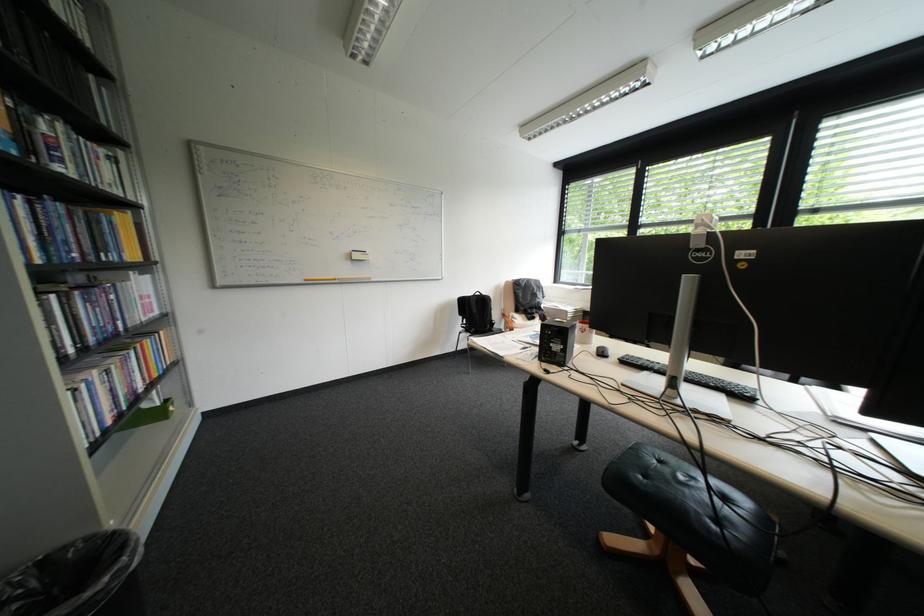
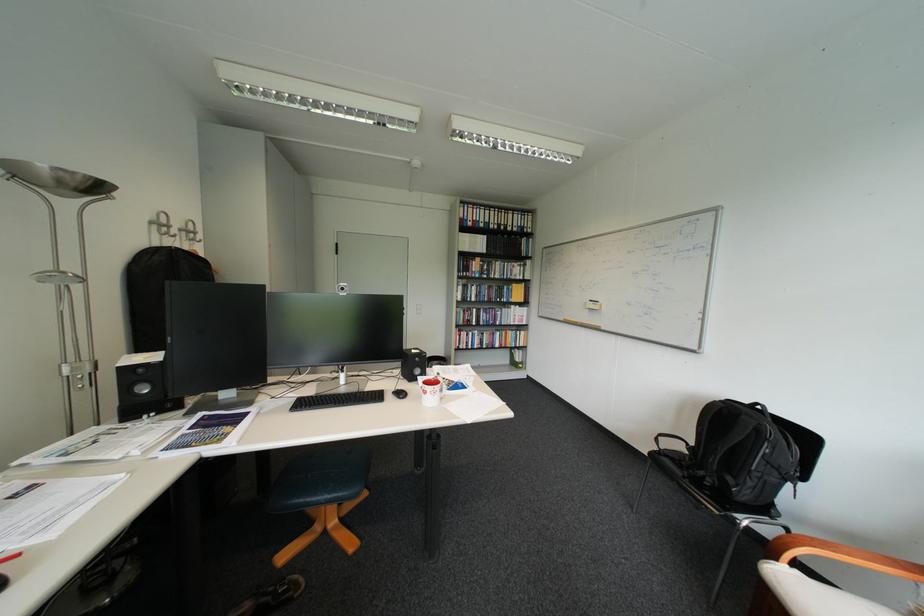
Locate, in the second image, the point that corresponds to point (496, 297) in the first image.

(756, 418)